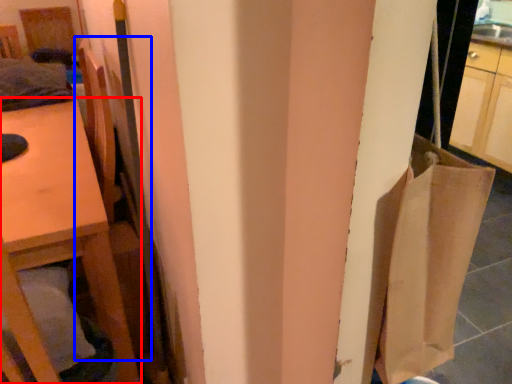
Question: Which of the following is the farthest to the observer, furniture (highlighted by a red box) or chair (highlighted by a blue box)?

Choices:
 (A) furniture
 (B) chair

Answer: (A)